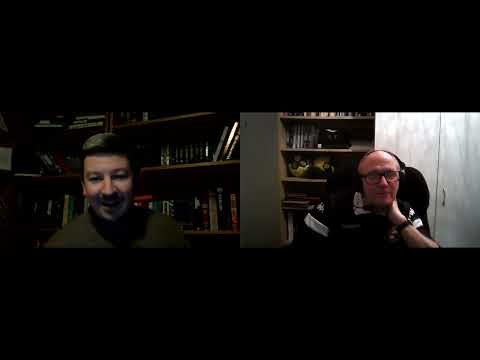
Find the location of `books`. books is located at coordinates click(x=205, y=202).